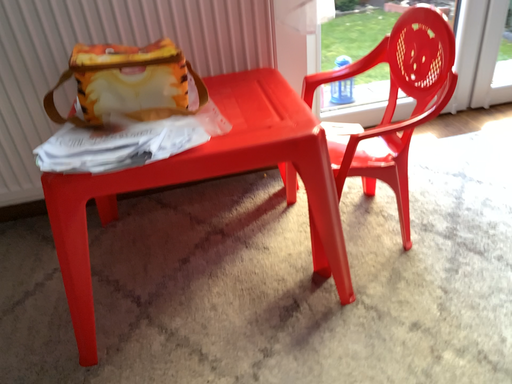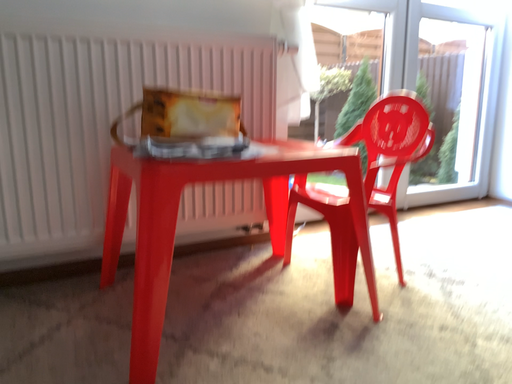
Question: Which way did the camera rotate in the video?

Choices:
 (A) rotated upward
 (B) rotated downward

Answer: (A)